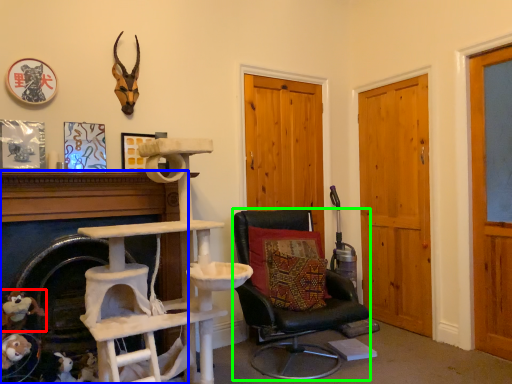
Question: Which object is positioned farthest from toy (highlighted by a red box)? Select from fireplace (highlighted by a blue box) and chair (highlighted by a green box).

Choices:
 (A) fireplace
 (B) chair

Answer: (B)